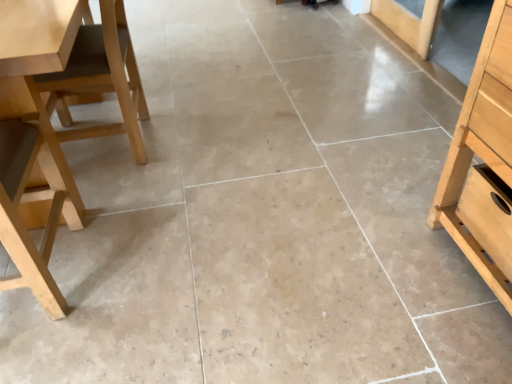
Question: From a real-world perspective, is light brown wood chair at left, acting as the first chair starting from the back, located higher than light wood chair at left, which is counted as the second chair, starting from the back?

Choices:
 (A) yes
 (B) no

Answer: (B)

Question: Is light brown wood chair at left, acting as the first chair starting from the back, oriented towards light wood chair at left, the first chair when ordered from front to back?

Choices:
 (A) no
 (B) yes

Answer: (B)

Question: Is light brown wood chair at left, acting as the first chair starting from the back, shorter than light wood chair at left, the first chair when ordered from front to back?

Choices:
 (A) yes
 (B) no

Answer: (A)

Question: Can you confirm if light brown wood chair at left, acting as the first chair starting from the back, is smaller than light wood chair at left, the first chair when ordered from front to back?

Choices:
 (A) yes
 (B) no

Answer: (A)

Question: From a real-world perspective, is light brown wood chair at left, the 2th chair in the front-to-back sequence, below light wood chair at left, the first chair when ordered from front to back?

Choices:
 (A) yes
 (B) no

Answer: (A)

Question: From a real-world perspective, relative to light wood chair at left, the first chair when ordered from front to back, is light wood drawer at right vertically above or below?

Choices:
 (A) above
 (B) below

Answer: (B)

Question: Is light wood drawer at right taller or shorter than light wood chair at left, which is counted as the second chair, starting from the back?

Choices:
 (A) tall
 (B) short

Answer: (B)

Question: Based on their positions, is light wood drawer at right located to the left or right of light wood chair at left, which is counted as the second chair, starting from the back?

Choices:
 (A) left
 (B) right

Answer: (B)

Question: Choose the correct answer: Is light wood drawer at right inside light wood chair at left, the first chair when ordered from front to back, or outside it?

Choices:
 (A) inside
 (B) outside

Answer: (B)

Question: Based on their positions, is light wood table at left located to the left or right of light wood drawer at right?

Choices:
 (A) right
 (B) left

Answer: (B)

Question: Considering the positions of light wood table at left and light wood drawer at right in the image, is light wood table at left bigger or smaller than light wood drawer at right?

Choices:
 (A) big
 (B) small

Answer: (A)

Question: From a real-world perspective, is light wood table at left above or below light wood drawer at right?

Choices:
 (A) below
 (B) above

Answer: (B)

Question: Is light wood table at left taller or shorter than light wood drawer at right?

Choices:
 (A) tall
 (B) short

Answer: (A)

Question: Is point (120, 0) closer or farther from the camera than point (498, 223)?

Choices:
 (A) closer
 (B) farther

Answer: (B)

Question: Visually, is light brown wood chair at left, the 2th chair in the front-to-back sequence, positioned to the left or to the right of light wood drawer at right?

Choices:
 (A) left
 (B) right

Answer: (A)